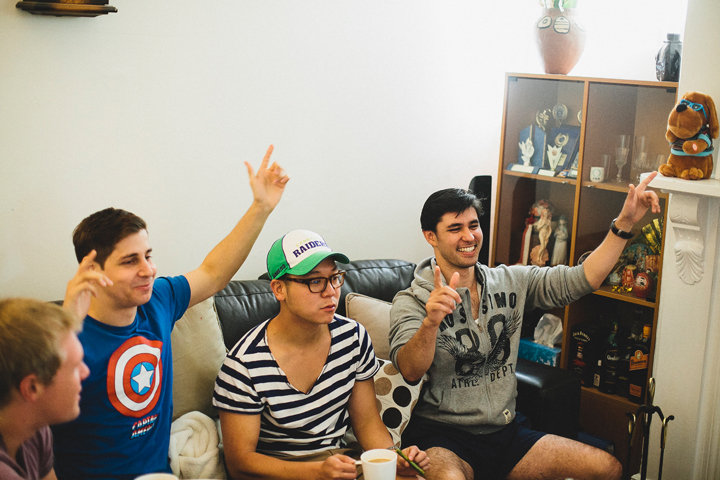
Find the location of a particular element. stuffed animal is located at coordinates (688, 124).